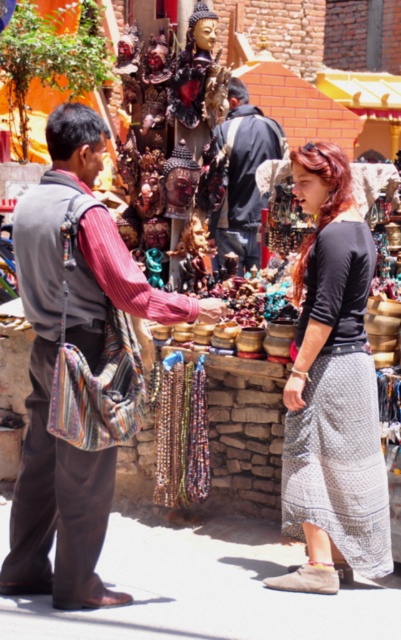
Where is `black cotton skirt at center`? black cotton skirt at center is located at coordinates (332, 392).

Does point (354, 276) come in front of point (162, 452)?

Yes, point (354, 276) is in front of point (162, 452).

Image resolution: width=401 pixels, height=640 pixels. Find the location of `black cotton skirt at center`. black cotton skirt at center is located at coordinates (332, 392).

Which is more to the right, dark blue fabric jacket at center or multicolored beaded necklace at center?

Positioned to the right is dark blue fabric jacket at center.

This screenshot has height=640, width=401. What do you see at coordinates (243, 177) in the screenshot?
I see `dark blue fabric jacket at center` at bounding box center [243, 177].

What do you see at coordinates (243, 177) in the screenshot?
I see `dark blue fabric jacket at center` at bounding box center [243, 177].

You are a GUI agent. You are given a task and a screenshot of the screen. Output one action in this format:
    pyautogui.click(x=<x>, y=<y>)
    Task: Click on the dark blue fabric jacket at center
    The height and width of the screenshot is (640, 401).
    Given the screenshot: What is the action you would take?
    pyautogui.click(x=243, y=177)

Between black cotton skirt at center and dark blue fabric jacket at center, which one has more height?

black cotton skirt at center

Between point (336, 307) and point (243, 218), which one is positioned in front?

Point (336, 307) is more forward.

You are a GUI agent. You are given a task and a screenshot of the screen. Output one action in this format:
    pyautogui.click(x=<x>, y=<y>)
    Task: Click on the black cotton skirt at center
    
    Given the screenshot: What is the action you would take?
    pyautogui.click(x=332, y=392)